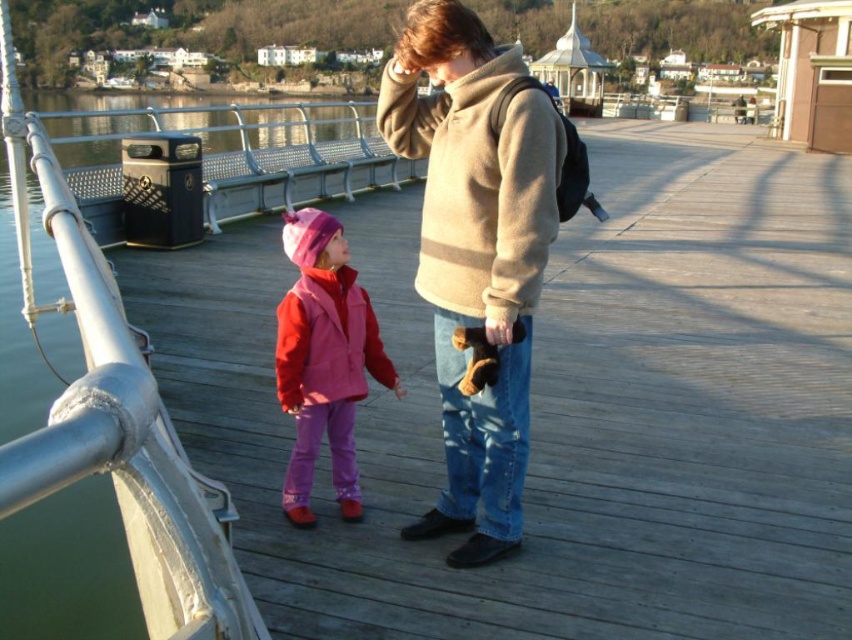
Question: Does beige woolen jacket at center appear under pink fleece jacket at center?

Choices:
 (A) no
 (B) yes

Answer: (A)

Question: Can you confirm if beige woolen sweater at center is smaller than pink fleece jacket at center?

Choices:
 (A) yes
 (B) no

Answer: (B)

Question: Among these objects, which one is nearest to the camera?

Choices:
 (A) beige woolen jacket at center
 (B) beige woolen sweater at center

Answer: (B)

Question: Based on their relative distances, which object is nearer to the beige woolen sweater at center?

Choices:
 (A) beige woolen jacket at center
 (B) pink fleece jacket at center

Answer: (A)

Question: Does beige woolen sweater at center appear over pink fleece jacket at center?

Choices:
 (A) yes
 (B) no

Answer: (A)

Question: Which object is positioned farthest from the beige woolen sweater at center?

Choices:
 (A) beige woolen jacket at center
 (B) pink fleece jacket at center

Answer: (B)